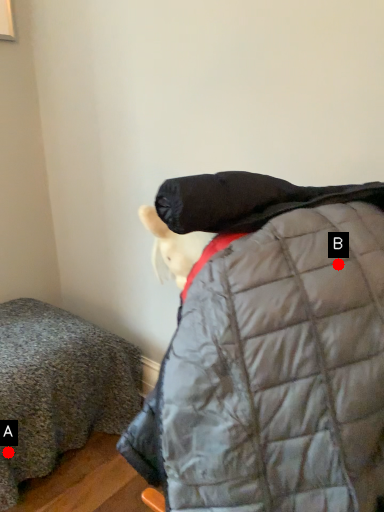
Question: Two points are circled on the image, labeled by A and B beside each circle. Which of the following is the closest to the observer?

Choices:
 (A) A is closer
 (B) B is closer

Answer: (B)